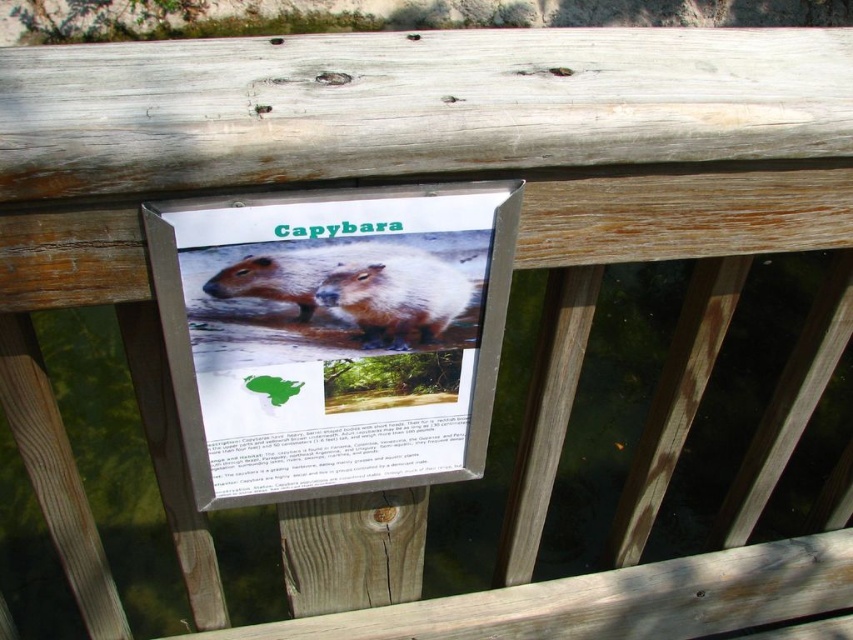
Question: Does metal sign at center have a greater width compared to brown furry capybara at center?

Choices:
 (A) no
 (B) yes

Answer: (B)

Question: Which of the following is the farthest from the observer?

Choices:
 (A) (299, 273)
 (B) (430, 465)

Answer: (B)

Question: Which is nearer to the brown furry capybara at center?

Choices:
 (A) metal sign at center
 (B) brown furry beaver at center

Answer: (B)

Question: Estimate the real-world distances between objects in this image. Which object is farther from the metal sign at center?

Choices:
 (A) brown furry capybara at center
 (B) brown furry beaver at center

Answer: (A)

Question: From the image, what is the correct spatial relationship of metal sign at center in relation to brown furry beaver at center?

Choices:
 (A) right
 (B) left

Answer: (B)

Question: Is metal sign at center to the right of brown furry capybara at center from the viewer's perspective?

Choices:
 (A) yes
 (B) no

Answer: (A)